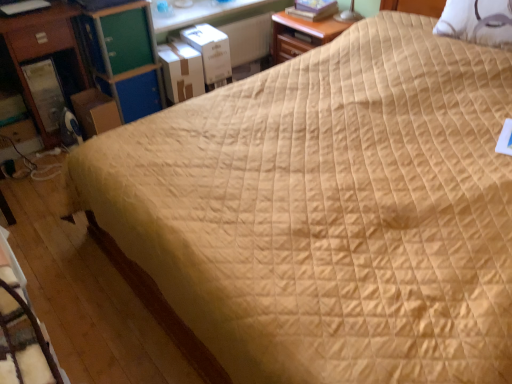
Find the location of a particular element. The height and width of the screenshot is (384, 512). free space above white cardboard box at upper left, the 2th cardboard box in the left-to-right sequence (from a real-world perspective) is located at coordinates (175, 48).